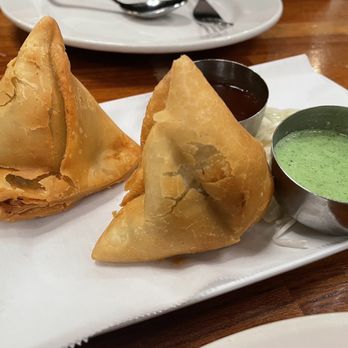
At what (x,y) coordinates should I click in order to perform the action: click on wooden table. Please return your answer as a coordinate pair (x, y). Looking at the image, I should click on coord(277,305).